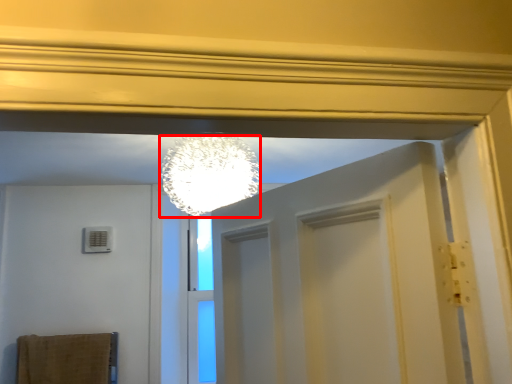
Question: In this image, where is lamp (annotated by the red box) located relative to bath towel?

Choices:
 (A) left
 (B) right

Answer: (B)